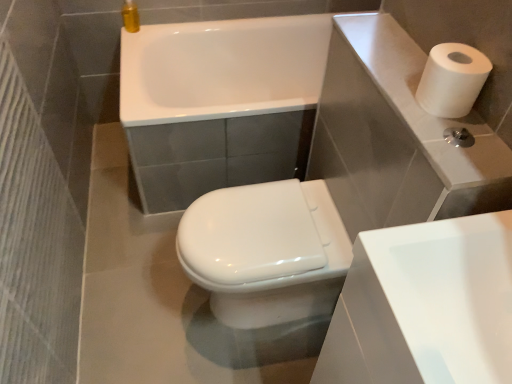
Question: Is white glossy sink at lower right inside or outside of white glossy bidet at center?

Choices:
 (A) outside
 (B) inside

Answer: (A)

Question: Looking at their shapes, would you say white glossy sink at lower right is wider or thinner than white glossy bidet at center?

Choices:
 (A) thin
 (B) wide

Answer: (A)

Question: Which of these objects is positioned closest to the white glossy bathtub at upper center?

Choices:
 (A) white matte paper towel at upper right
 (B) white glossy bidet at center
 (C) white glossy sink at lower right

Answer: (B)

Question: Which of these objects is positioned closest to the white glossy sink at lower right?

Choices:
 (A) white glossy bathtub at upper center
 (B) white matte paper towel at upper right
 (C) white glossy bidet at center

Answer: (B)